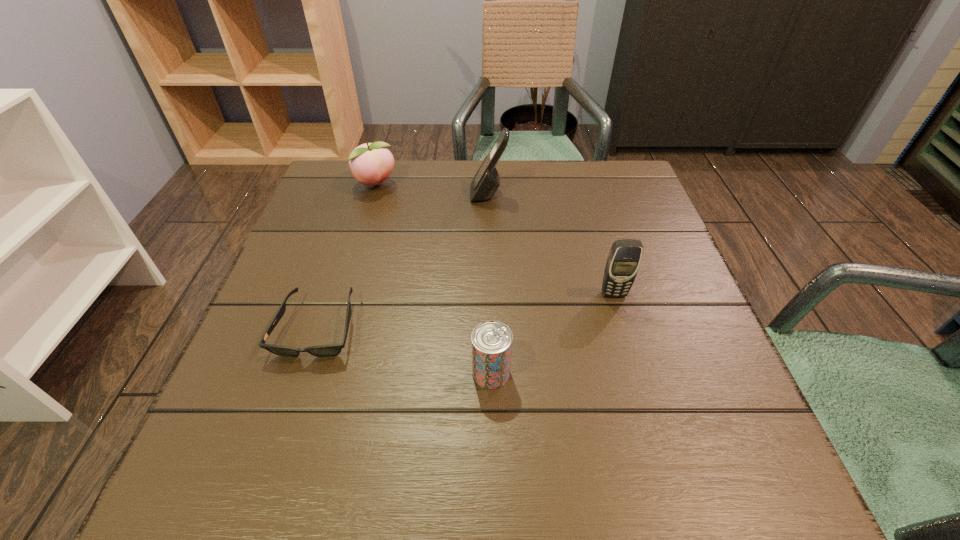
The image size is (960, 540). In order to click on the tallest object in this screenshot , I will do `click(486, 181)`.

At what (x,y) coordinates should I click in order to perform the action: click on the left cellular telephone. Please return your answer as a coordinate pair (x, y). The width and height of the screenshot is (960, 540). Looking at the image, I should click on (486, 181).

What are the coordinates of `the shorter cellular telephone` in the screenshot? It's located at (623, 261).

The height and width of the screenshot is (540, 960). I want to click on the right cellular telephone, so click(x=623, y=261).

I want to click on peach, so click(371, 163).

Find the location of `the second shortest object`. the second shortest object is located at coordinates (491, 341).

The height and width of the screenshot is (540, 960). In order to click on the shortest object in this screenshot , I will do `click(329, 350)`.

What are the coordinates of `vacant region located on the front-facing side of the tallest object` in the screenshot? It's located at (348, 194).

Find the location of a particular element. This screenshot has height=540, width=960. free spot located on the front-facing side of the tallest object is located at coordinates 420,194.

The height and width of the screenshot is (540, 960). In order to click on free spot located 0.060m on the front-facing side of the tallest object in this screenshot , I will do `click(446, 194)`.